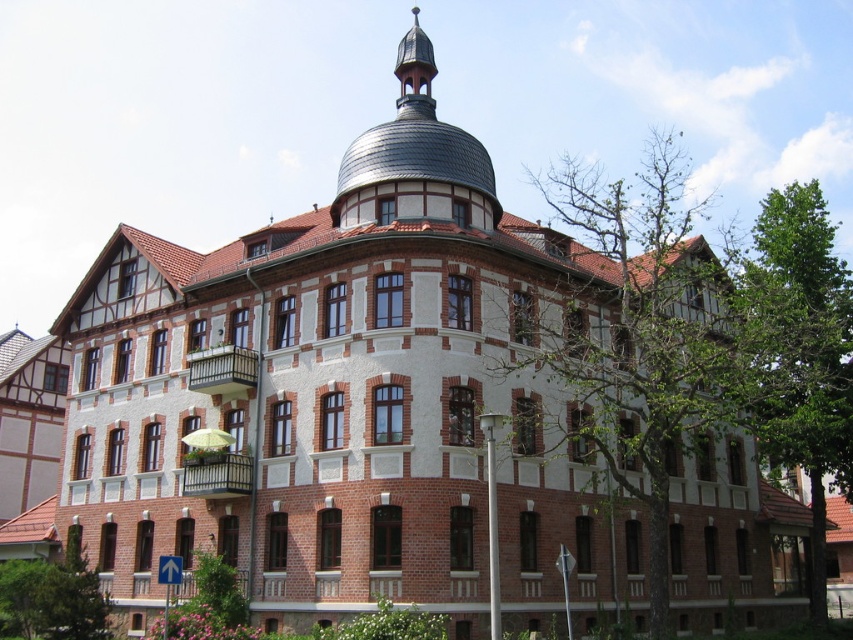
Can you confirm if green leafy tree at upper right is smaller than green leafy tree at right?

Actually, green leafy tree at upper right might be larger than green leafy tree at right.

Is green leafy tree at upper right positioned in front of green leafy tree at right?

Yes.

This screenshot has width=853, height=640. Describe the element at coordinates (695, 337) in the screenshot. I see `green leafy tree at upper right` at that location.

Find the location of a particular element. green leafy tree at upper right is located at coordinates tap(695, 337).